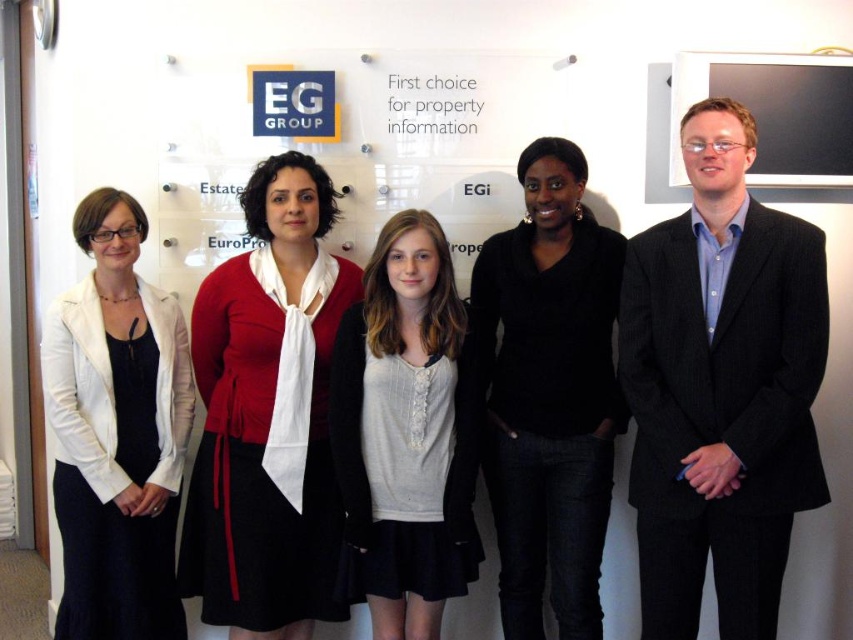
Based on the scene description, which object is taller between the black matte sweater at center and the white matte blazer at left?

The black matte sweater at center is taller than the white matte blazer at left according to the description.

You are a photographer taking a group photo of the individuals in the scene. You need to ensure that the blue pinstripe suit at right and the light gray knit sweater at center are both visible in the frame. Based on their heights, which person should you position closer to the front to avoid blocking the other?

The light gray knit sweater at center should be positioned closer to the front since the blue pinstripe suit at right is taller. This arrangement will prevent the taller individual in the blue pinstripe suit from blocking the shorter person in the light gray knit sweater.